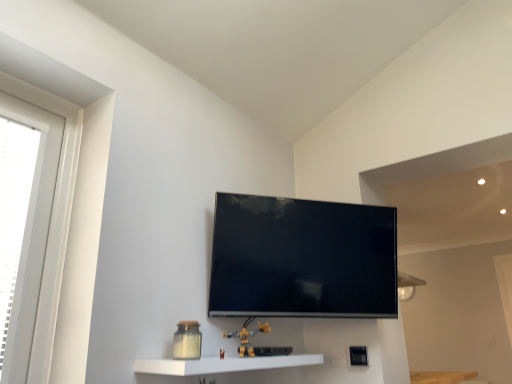
Question: Is yellow plastic toy at lower center positioned with its back to flat screen tv at center?

Choices:
 (A) no
 (B) yes

Answer: (A)

Question: Can you see yellow plastic toy at lower center touching flat screen tv at center?

Choices:
 (A) no
 (B) yes

Answer: (A)

Question: Does yellow plastic toy at lower center have a lesser width compared to flat screen tv at center?

Choices:
 (A) no
 (B) yes

Answer: (B)

Question: From the image's perspective, is yellow plastic toy at lower center below flat screen tv at center?

Choices:
 (A) no
 (B) yes

Answer: (B)

Question: From the image's perspective, is yellow plastic toy at lower center above flat screen tv at center?

Choices:
 (A) no
 (B) yes

Answer: (A)

Question: From their relative heights in the image, would you say yellow plastic toy at lower center is taller or shorter than flat screen tv at center?

Choices:
 (A) short
 (B) tall

Answer: (A)

Question: Is yellow plastic toy at lower center situated inside flat screen tv at center or outside?

Choices:
 (A) outside
 (B) inside

Answer: (A)

Question: Is yellow plastic toy at lower center to the left or to the right of flat screen tv at center in the image?

Choices:
 (A) left
 (B) right

Answer: (A)

Question: Based on their sizes in the image, would you say yellow plastic toy at lower center is bigger or smaller than flat screen tv at center?

Choices:
 (A) small
 (B) big

Answer: (A)

Question: In terms of height, does white plastic window at left look taller or shorter compared to flat screen tv at center?

Choices:
 (A) tall
 (B) short

Answer: (A)

Question: In the image, is white plastic window at left positioned in front of or behind flat screen tv at center?

Choices:
 (A) behind
 (B) front

Answer: (B)

Question: Considering the positions of white plastic window at left and flat screen tv at center in the image, is white plastic window at left bigger or smaller than flat screen tv at center?

Choices:
 (A) big
 (B) small

Answer: (B)

Question: From the image's perspective, relative to flat screen tv at center, is white plastic window at left above or below?

Choices:
 (A) below
 (B) above

Answer: (B)

Question: Do you think yellow plastic toy at lower center is within white glossy shelf at lower center, or outside of it?

Choices:
 (A) inside
 (B) outside

Answer: (B)

Question: In terms of height, does yellow plastic toy at lower center look taller or shorter compared to white glossy shelf at lower center?

Choices:
 (A) tall
 (B) short

Answer: (A)